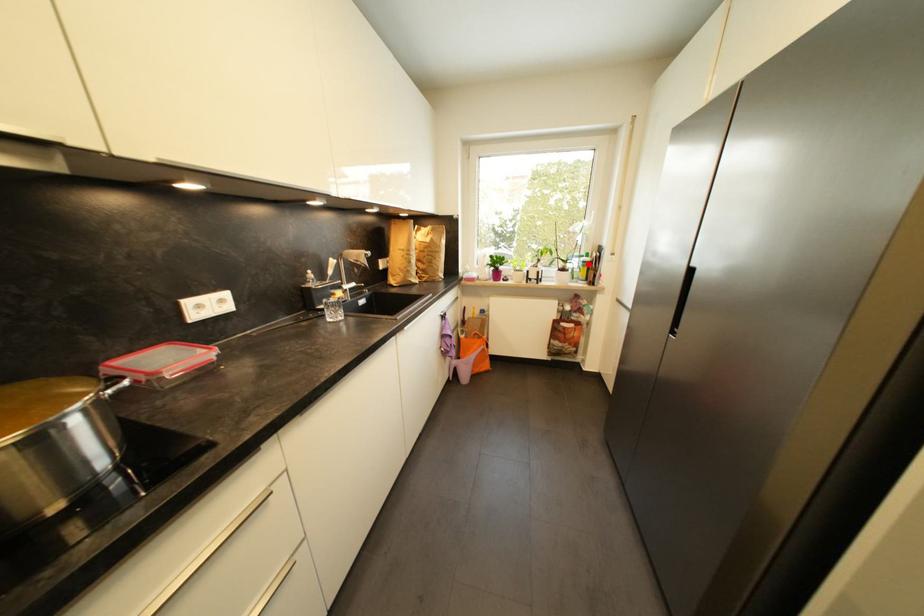
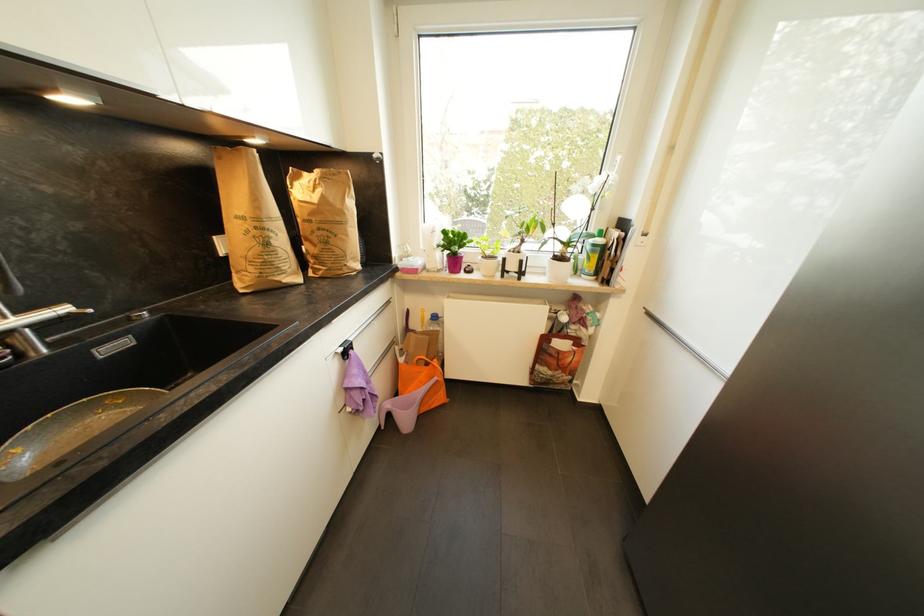
In the second image, find the point that corresponds to the highlighted location in the first image.

(599, 246)